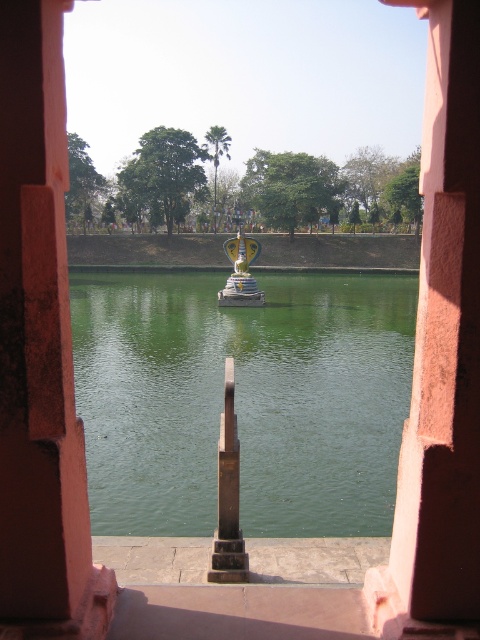
Describe the element at coordinates (242, 400) in the screenshot. I see `green smooth water at center` at that location.

Is green smooth water at center to the left of smooth pink stone pillar at center from the viewer's perspective?

Incorrect, green smooth water at center is not on the left side of smooth pink stone pillar at center.

Identify the location of green smooth water at center. The width and height of the screenshot is (480, 640). (242, 400).